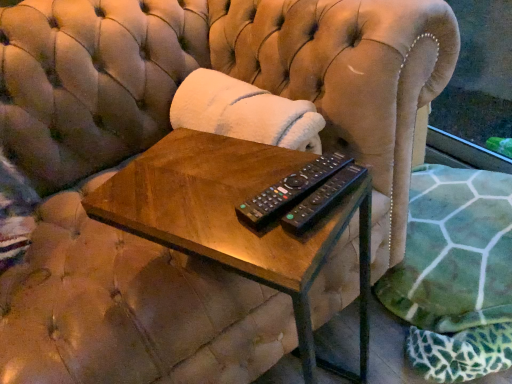
Question: Is woodenmaterial/texturetable at center completely or partially inside black plastic remote at center, the first remote control positioned from the front?

Choices:
 (A) yes
 (B) no

Answer: (B)

Question: Could you tell me if black plastic remote at center, the second remote control viewed from the back, is turned towards woodenmaterial/texturetable at center?

Choices:
 (A) no
 (B) yes

Answer: (A)

Question: Are black plastic remote at center, the second remote control viewed from the back, and woodenmaterial/texturetable at center making contact?

Choices:
 (A) yes
 (B) no

Answer: (B)

Question: Can you confirm if black plastic remote at center, the first remote control positioned from the front, is taller than woodenmaterial/texturetable at center?

Choices:
 (A) yes
 (B) no

Answer: (B)

Question: Is black plastic remote at center, the second remote control viewed from the back, to the right of woodenmaterial/texturetable at center from the viewer's perspective?

Choices:
 (A) yes
 (B) no

Answer: (A)

Question: Considering their positions, is woodenmaterial/texturetable at center located in front of or behind black plastic remote at center, the first remote control from the back?

Choices:
 (A) behind
 (B) front

Answer: (B)

Question: Based on their sizes in the image, would you say woodenmaterial/texturetable at center is bigger or smaller than black plastic remote at center, which appears as the 2th remote control when viewed from the front?

Choices:
 (A) big
 (B) small

Answer: (A)

Question: Is woodenmaterial/texturetable at center wider or thinner than black plastic remote at center, which appears as the 2th remote control when viewed from the front?

Choices:
 (A) wide
 (B) thin

Answer: (A)

Question: From the image's perspective, is woodenmaterial/texturetable at center located above or below black plastic remote at center, which appears as the 2th remote control when viewed from the front?

Choices:
 (A) above
 (B) below

Answer: (B)

Question: From their relative heights in the image, would you say black plastic remote at center, the first remote control positioned from the front, is taller or shorter than black plastic remote at center, which appears as the 2th remote control when viewed from the front?

Choices:
 (A) tall
 (B) short

Answer: (B)

Question: From the image's perspective, is black plastic remote at center, the first remote control positioned from the front, positioned above or below black plastic remote at center, the first remote control from the back?

Choices:
 (A) above
 (B) below

Answer: (B)

Question: From a real-world perspective, relative to black plastic remote at center, which appears as the 2th remote control when viewed from the front, is black plastic remote at center, the second remote control viewed from the back, vertically above or below?

Choices:
 (A) below
 (B) above

Answer: (B)

Question: Is black plastic remote at center, the second remote control viewed from the back, wider or thinner than black plastic remote at center, the first remote control from the back?

Choices:
 (A) wide
 (B) thin

Answer: (B)

Question: Is black plastic remote at center, the first remote control from the back, inside or outside of black plastic remote at center, the second remote control viewed from the back?

Choices:
 (A) outside
 (B) inside

Answer: (A)

Question: Is black plastic remote at center, which appears as the 2th remote control when viewed from the front, in front of or behind black plastic remote at center, the second remote control viewed from the back, in the image?

Choices:
 (A) front
 (B) behind

Answer: (B)